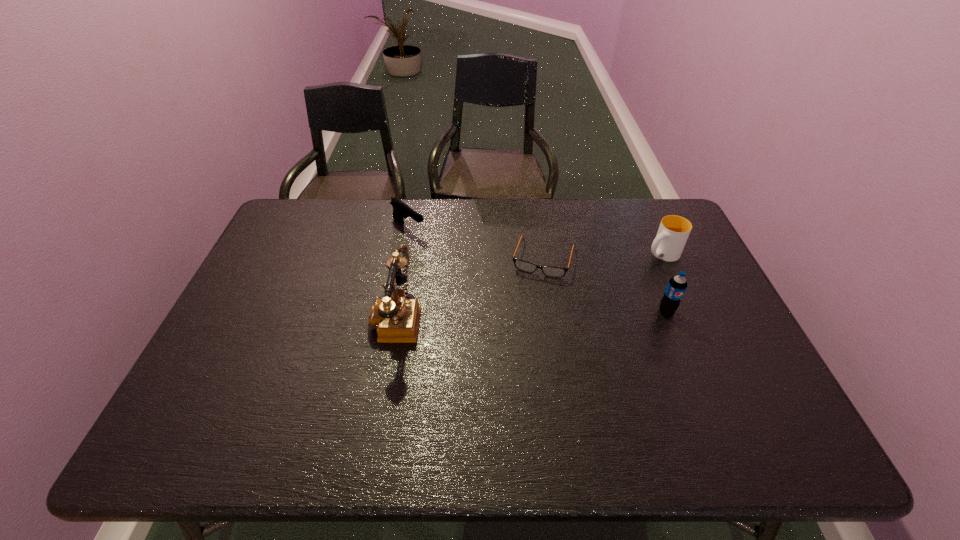
Locate an element on the screen. Image resolution: width=960 pixels, height=540 pixels. vacant space on the desktop that is between the telephone and the soda bottle and is positioned with the handle on the side of the cup is located at coordinates (567, 313).

Locate an element on the screen. This screenshot has width=960, height=540. free spot on the desktop that is between the telephone and the second tallest object and is positioned on the front-facing side of the pistol is located at coordinates (526, 314).

Where is `free space on the desktop that is between the telephone and the soda bottle and is positioned on the front-facing side of the third object from left to right`? The image size is (960, 540). free space on the desktop that is between the telephone and the soda bottle and is positioned on the front-facing side of the third object from left to right is located at coordinates (527, 314).